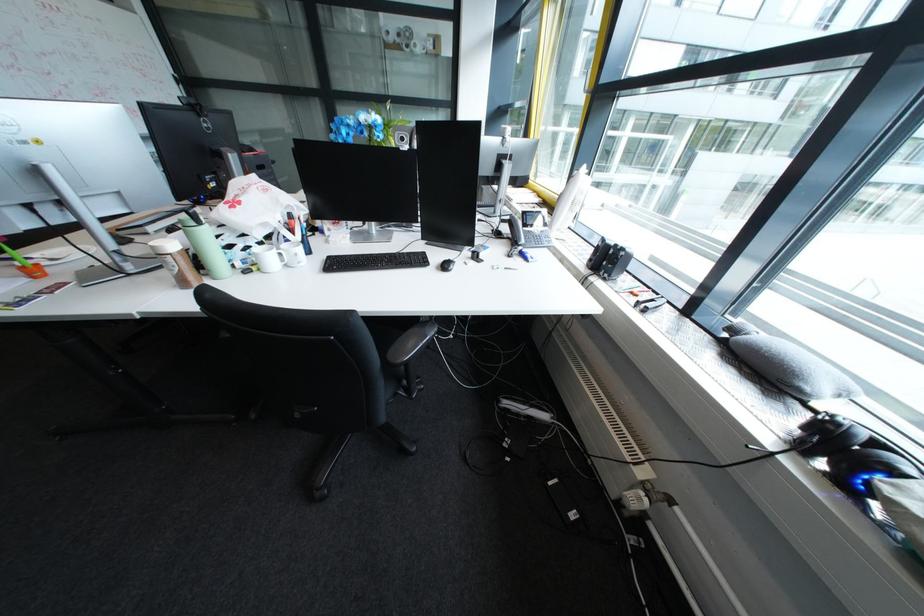
Where is `black headphones`? black headphones is located at coordinates (853, 453).